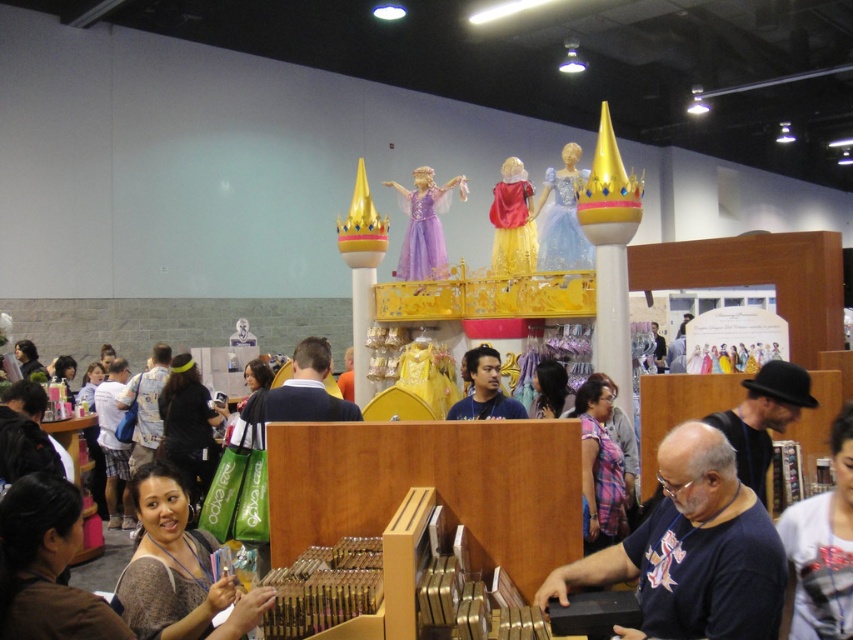
You are a photographer at the event and need to capture both the white printed shirt at lower right and the matte red dress at center in a single frame. Which object should you position closer to the camera to ensure both fit in the frame without cropping?

Since the white printed shirt at lower right is narrower than the matte red dress at center, you should position the white printed shirt at lower right closer to the camera. This will make it appear larger in the frame, balancing their sizes so both fit without cropping.

You are a photographer at the event and need to capture both the white printed shirt at lower right and the matte blue shirt at center in a single shot. Which shirt should you focus on first to ensure both are in frame?

The white printed shirt at lower right is below the matte blue shirt at center, so you should focus on the matte blue shirt at center first to ensure both are in frame.